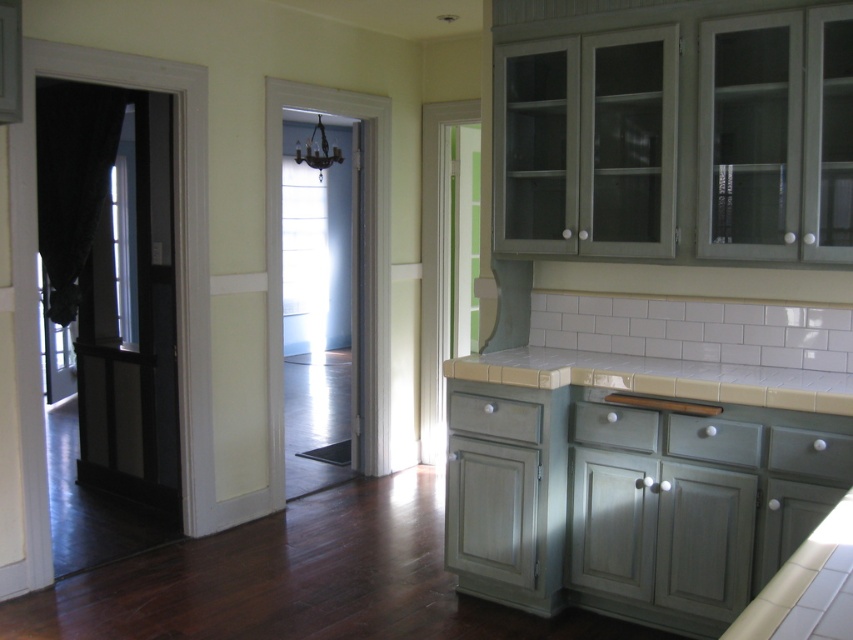
Is point (502, 429) positioned after point (490, 358)?

No, (502, 429) is in front of (490, 358).

Image resolution: width=853 pixels, height=640 pixels. What do you see at coordinates (636, 481) in the screenshot?
I see `white tile countertop at center` at bounding box center [636, 481].

In order to click on white tile countertop at center in this screenshot , I will do `click(636, 481)`.